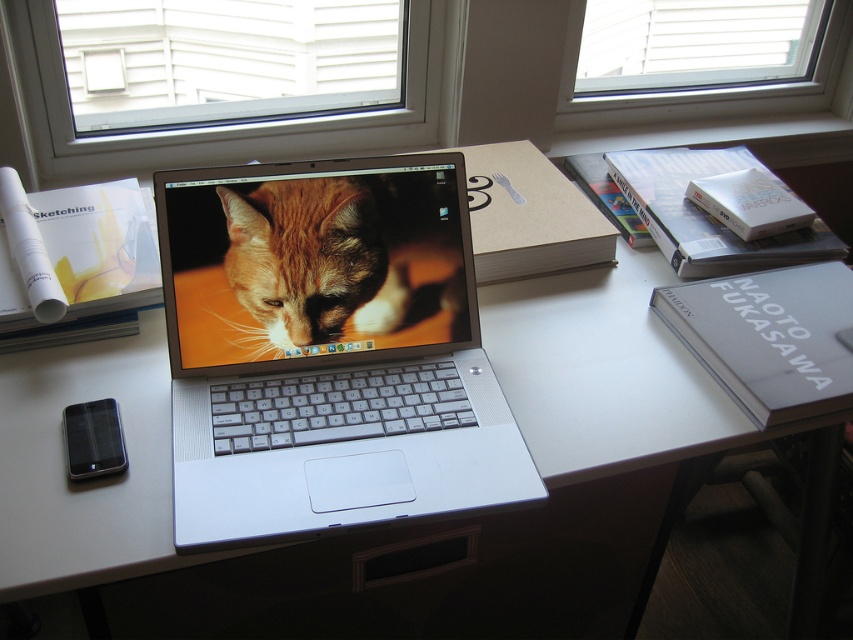
You are looking at the workspace setup. There are two points marked on the desk. One is at point [486,442] and the other is at point [383,52]. Which point is closer to you?

Point [486,442] is closer to the camera than point [383,52].

You are trying to take a photo of the silver metallic laptop at center using the white plastic window at upper center as a background. Will the laptop be in focus while the window is blurred?

Yes, since the silver metallic laptop at center is closer to the viewer than the white plastic window at upper center, the laptop will be in focus and the window will appear blurred in the photo.